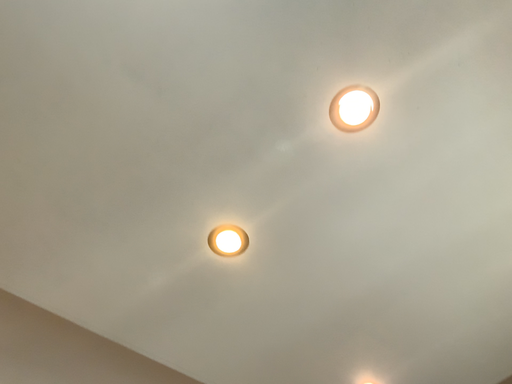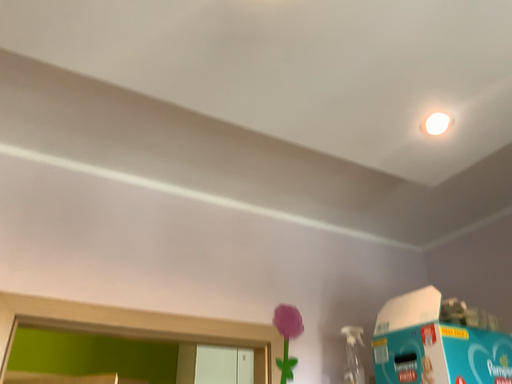
Question: How did the camera likely rotate when shooting the video?

Choices:
 (A) rotated downward
 (B) rotated upward

Answer: (A)